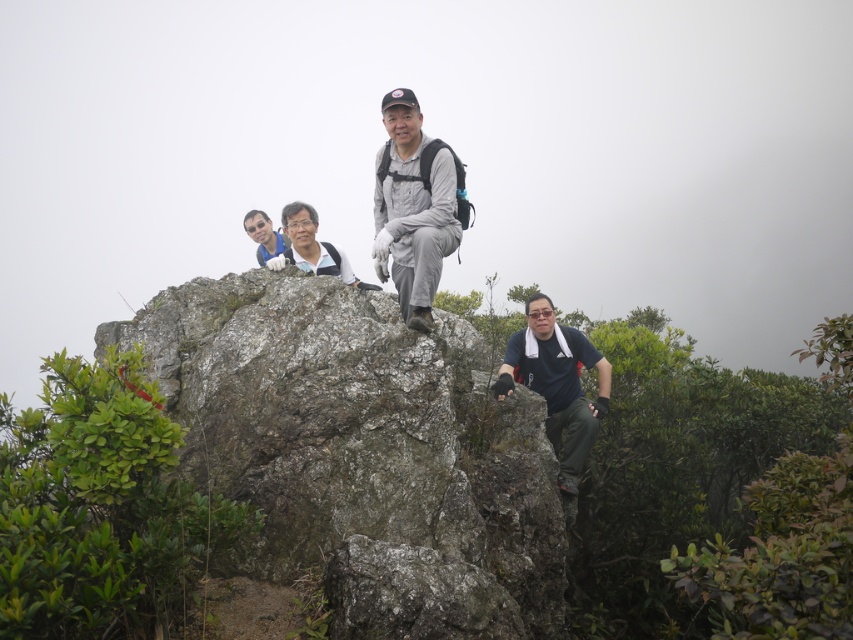
Question: Which of the following is the closest to the observer?

Choices:
 (A) (608, 365)
 (B) (392, 186)
 (C) (373, 592)

Answer: (C)

Question: Which point appears closest to the camera in this image?

Choices:
 (A) (422, 177)
 (B) (363, 451)
 (C) (596, 403)

Answer: (B)

Question: From the image, what is the correct spatial relationship of gray fabric jacket at center in relation to dark blue t-shirt at center?

Choices:
 (A) left
 (B) right

Answer: (A)

Question: Estimate the real-world distances between objects in this image. Which object is farther from the gray rough rock at center?

Choices:
 (A) gray fabric jacket at center
 (B) dark blue t-shirt at center

Answer: (B)

Question: Is gray rough rock at center above dark blue t-shirt at center?

Choices:
 (A) no
 (B) yes

Answer: (B)

Question: Is gray rough rock at center behind gray fabric jacket at center?

Choices:
 (A) no
 (B) yes

Answer: (A)